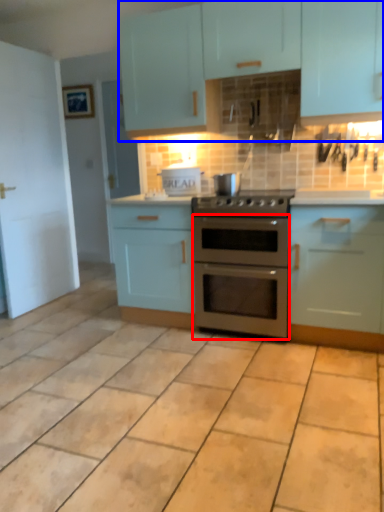
Question: Which object appears farthest to the camera in this image, oven (highlighted by a red box) or cabinetry (highlighted by a blue box)?

Choices:
 (A) oven
 (B) cabinetry

Answer: (A)